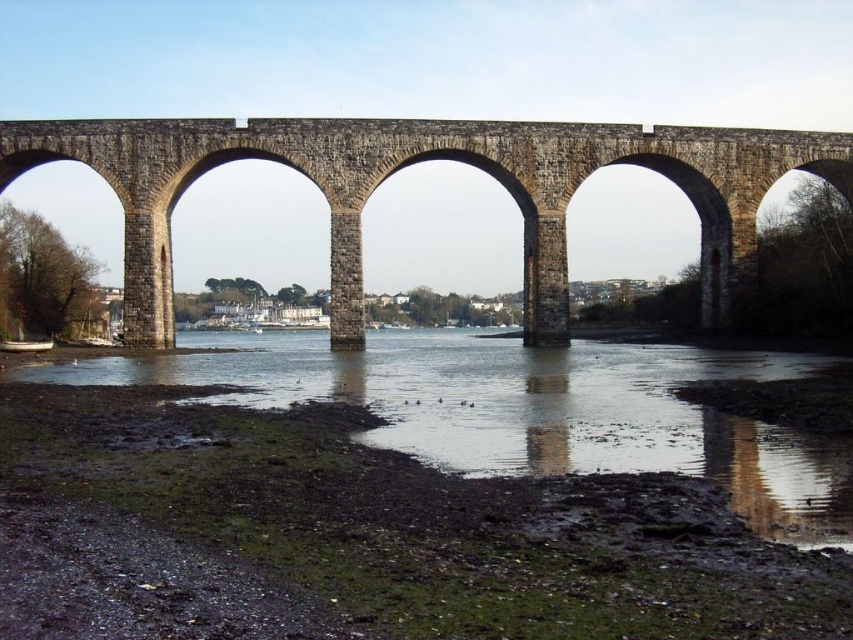
Question: Is muddy wet sand at lower left below stone arch bridge at center?

Choices:
 (A) yes
 (B) no

Answer: (A)

Question: Which point is farther to the camera?

Choices:
 (A) stone arch bridge at center
 (B) muddy wet sand at lower left

Answer: (A)

Question: Is muddy wet sand at lower left smaller than stone arch bridge at center?

Choices:
 (A) yes
 (B) no

Answer: (B)

Question: Is muddy wet sand at lower left in front of stone arch bridge at center?

Choices:
 (A) yes
 (B) no

Answer: (A)

Question: Which point appears closest to the camera in this image?

Choices:
 (A) (276, 394)
 (B) (343, 307)

Answer: (A)

Question: Which of the following is the closest to the observer?

Choices:
 (A) muddy wet sand at lower left
 (B) stone arch bridge at center

Answer: (A)